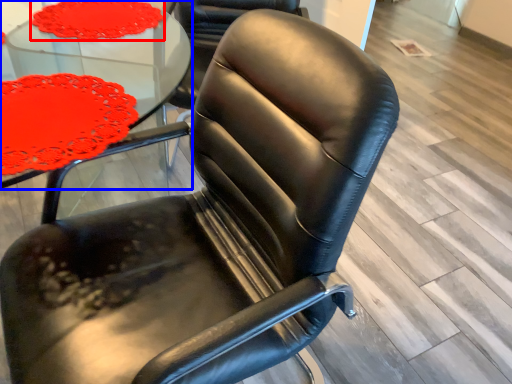
Question: Which of the following is the closest to the observer, tablecloth (highlighted by a red box) or table (highlighted by a blue box)?

Choices:
 (A) tablecloth
 (B) table

Answer: (B)